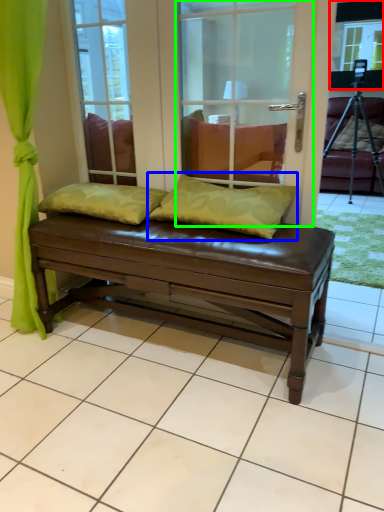
Question: Considering the real-world distances, which object is closest to window screen (highlighted by a red box)? pillow (highlighted by a blue box) or screen door (highlighted by a green box).

Choices:
 (A) pillow
 (B) screen door

Answer: (B)